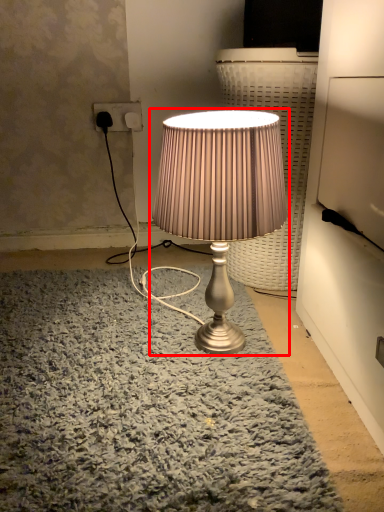
Question: From the image's perspective, where is lamp (annotated by the red box) located relative to electric outlet?

Choices:
 (A) below
 (B) above

Answer: (A)